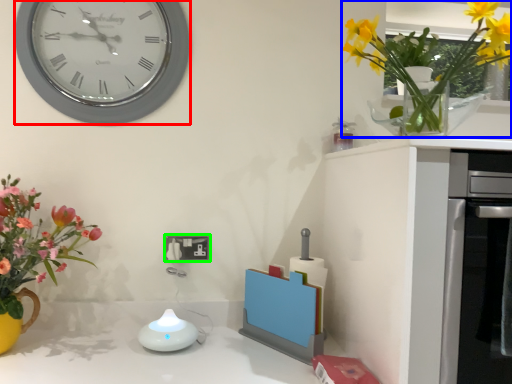
Question: Which object is the closest to the wall clock (highlighted by a red box)? Choose among these: floral arrangement (highlighted by a blue box) or electric outlet (highlighted by a green box).

Choices:
 (A) floral arrangement
 (B) electric outlet

Answer: (B)